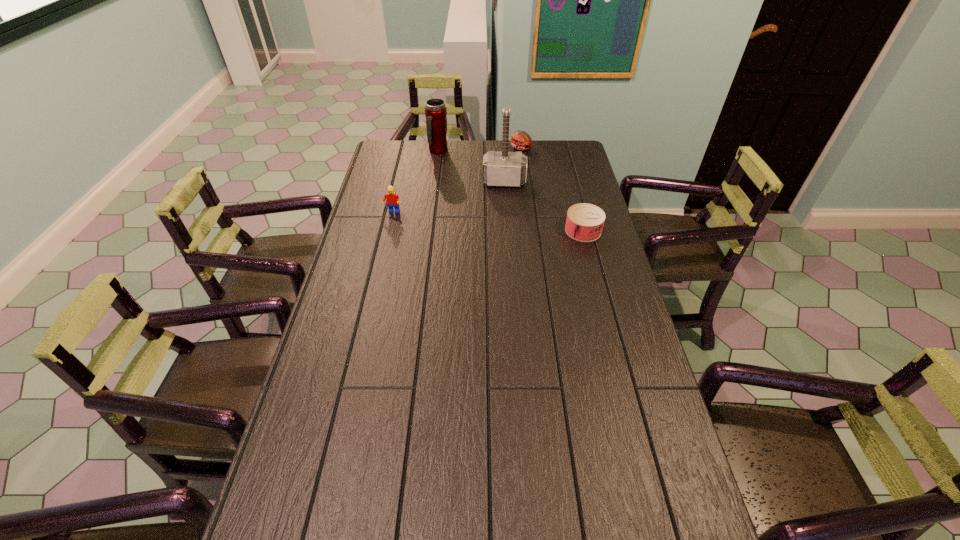
Where is `free space that satisfies the following two spatial constraints: 1. on the front-facing side of the nearest object; 2. on the right side of the second nearest object`? The image size is (960, 540). free space that satisfies the following two spatial constraints: 1. on the front-facing side of the nearest object; 2. on the right side of the second nearest object is located at coordinates [389, 231].

Locate an element on the screen. This screenshot has width=960, height=540. vacant position in the image that satisfies the following two spatial constraints: 1. on the front-facing side of the rightmost object; 2. on the left side of the Lego is located at coordinates (389, 231).

Where is `vacant area that satisfies the following two spatial constraints: 1. on the front-facing side of the nearest object; 2. on the right side of the third shortest object`? This screenshot has width=960, height=540. vacant area that satisfies the following two spatial constraints: 1. on the front-facing side of the nearest object; 2. on the right side of the third shortest object is located at coordinates (389, 231).

The image size is (960, 540). In order to click on vacant position in the image that satisfies the following two spatial constraints: 1. on the front side of the can; 2. on the left side of the third nearest object in this screenshot , I will do `click(508, 231)`.

The width and height of the screenshot is (960, 540). I want to click on free spot that satisfies the following two spatial constraints: 1. on the front side of the rightmost object; 2. on the right side of the hammer, so click(508, 231).